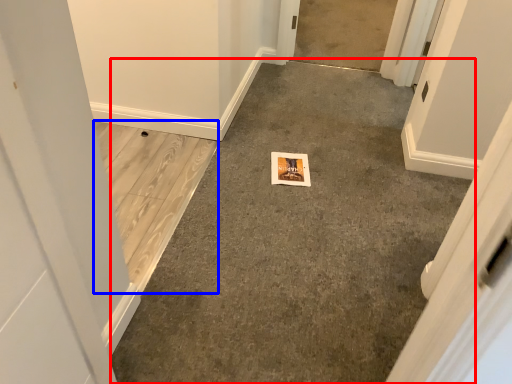
Question: Which object appears farthest to the camera in this image, concrete (highlighted by a red box) or concrete (highlighted by a blue box)?

Choices:
 (A) concrete
 (B) concrete

Answer: (B)